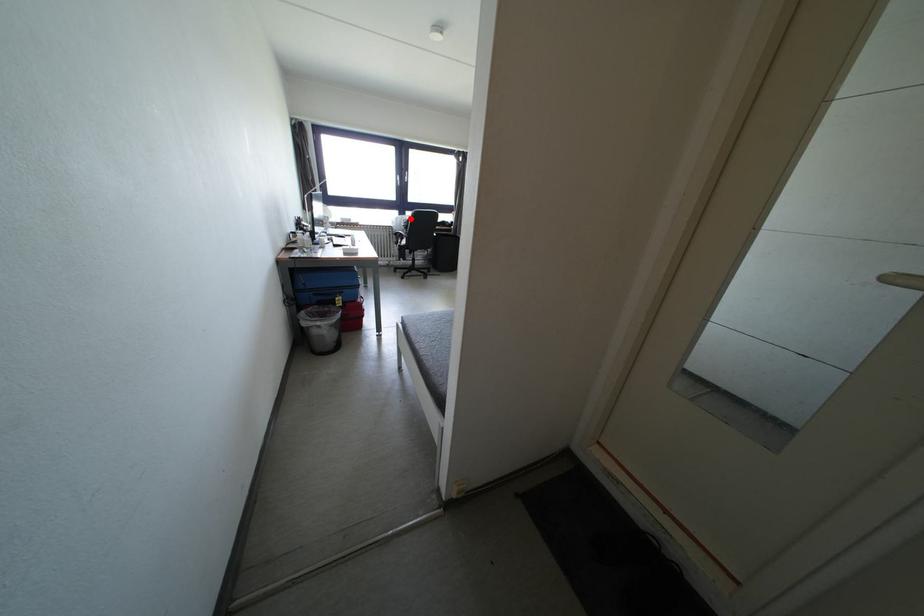
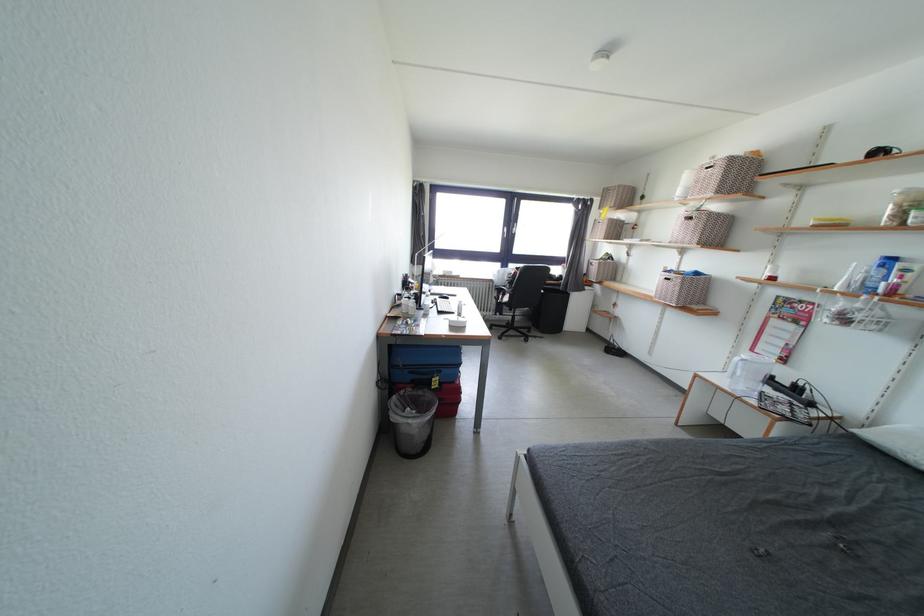
Where in the second image is the point corresponding to the highlighted location from the first image?

(514, 270)